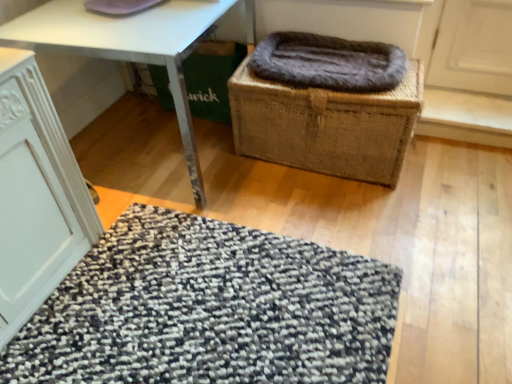
Where is `free space in front of woven brown basket at center`? Image resolution: width=512 pixels, height=384 pixels. free space in front of woven brown basket at center is located at coordinates (344, 233).